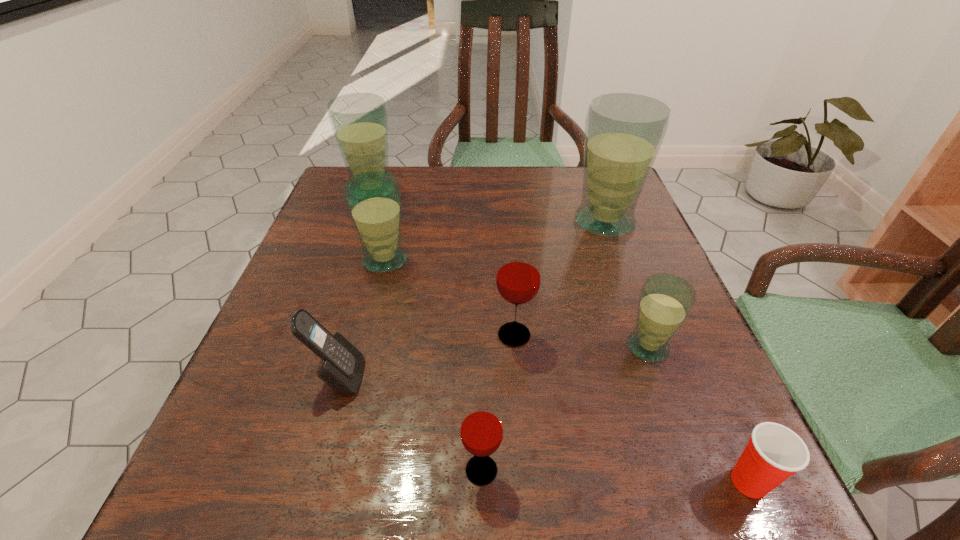
Where is `the tallest glass`? This screenshot has height=540, width=960. the tallest glass is located at coordinates (623, 131).

Identify the location of the biggest blue glass. (623, 131).

Locate an element on the screen. the third smallest blue glass is located at coordinates (359, 121).

What are the coordinates of `the fifth shortest glass` in the screenshot? It's located at (359, 121).

Identify the location of the third farthest glass. (374, 199).

Where is `the third farthest blue glass`? This screenshot has height=540, width=960. the third farthest blue glass is located at coordinates (374, 199).

Where is `the farther red glass`? the farther red glass is located at coordinates (518, 277).

At what (x,y) coordinates should I click in order to perform the action: click on cellular telephone. Please return your answer as a coordinate pair (x, y). The image size is (960, 540). Looking at the image, I should click on (341, 367).

Where is `the smallest blue glass`? This screenshot has width=960, height=540. the smallest blue glass is located at coordinates (665, 301).

Where is `the smaller red glass`? The image size is (960, 540). the smaller red glass is located at coordinates (481, 430).